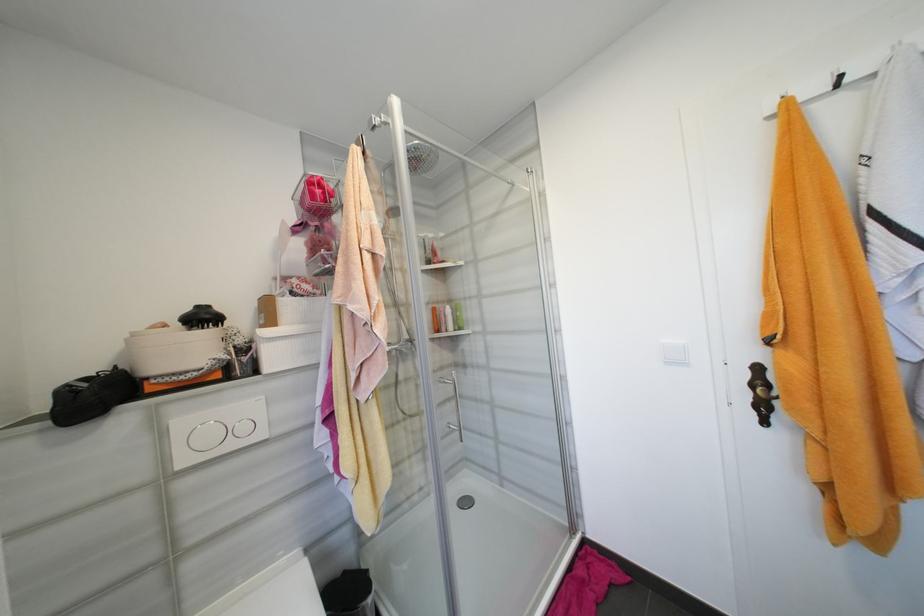
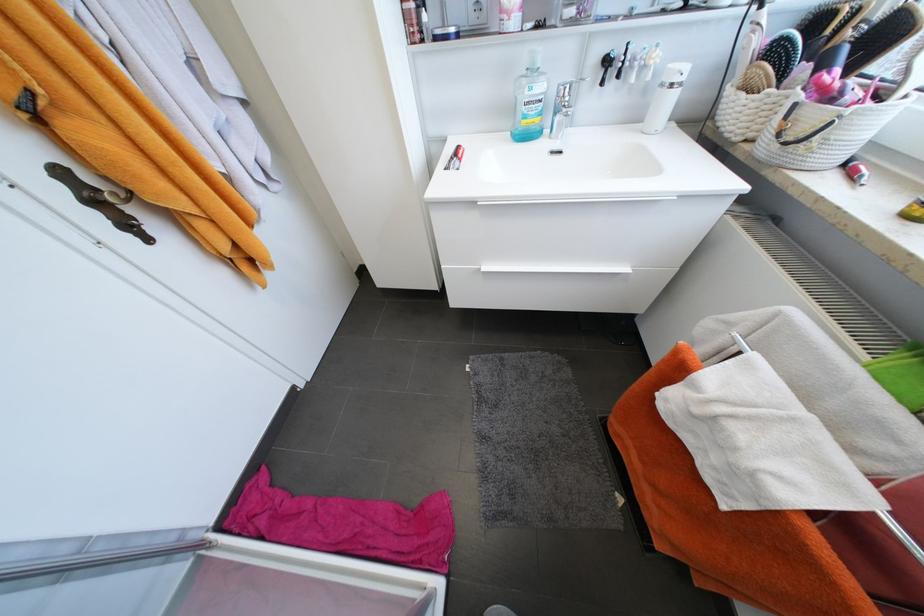
Locate, in the second image, the point that corresponds to point (769, 408) in the first image.

(132, 225)